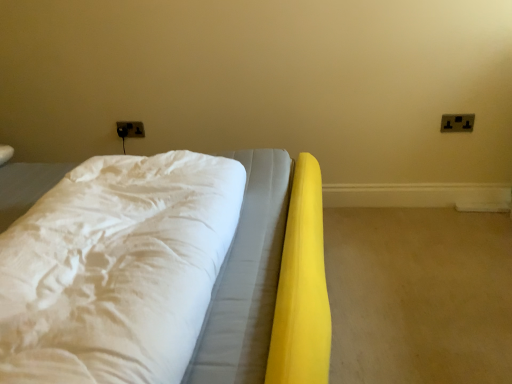
Question: Does black plastic electric outlet at upper right, placed as the first electric outlet when sorted from front to back, appear on the left side of black plastic electrical outlet at upper left, arranged as the second electric outlet when viewed from the right?

Choices:
 (A) yes
 (B) no

Answer: (B)

Question: Can you confirm if black plastic electric outlet at upper right, marked as the 1th electric outlet in a right-to-left arrangement, is wider than black plastic electrical outlet at upper left, which is the first electric outlet in back-to-front order?

Choices:
 (A) no
 (B) yes

Answer: (A)

Question: From the image's perspective, would you say black plastic electric outlet at upper right, arranged as the 2th electric outlet when viewed from the back, is shown under black plastic electrical outlet at upper left, which is counted as the first electric outlet, starting from the left?

Choices:
 (A) yes
 (B) no

Answer: (A)

Question: Can you confirm if black plastic electric outlet at upper right, marked as the 1th electric outlet in a right-to-left arrangement, is shorter than black plastic electrical outlet at upper left, arranged as the second electric outlet when viewed from the right?

Choices:
 (A) yes
 (B) no

Answer: (B)

Question: Does black plastic electric outlet at upper right, arranged as the 2th electric outlet when viewed from the back, have a larger size compared to black plastic electrical outlet at upper left, which is the first electric outlet in back-to-front order?

Choices:
 (A) yes
 (B) no

Answer: (B)

Question: Relative to black plastic electrical outlet at upper left, arranged as the second electric outlet when viewed from the right, is black plastic electric outlet at upper right, arranged as the 2th electric outlet when viewed from the back, in front or behind?

Choices:
 (A) front
 (B) behind

Answer: (A)

Question: Is point (441, 127) closer or farther from the camera than point (130, 132)?

Choices:
 (A) closer
 (B) farther

Answer: (A)

Question: Considering the positions of black plastic electric outlet at upper right, arranged as the 2th electric outlet when viewed from the back, and black plastic electrical outlet at upper left, which is counted as the first electric outlet, starting from the left, in the image, is black plastic electric outlet at upper right, arranged as the 2th electric outlet when viewed from the back, taller or shorter than black plastic electrical outlet at upper left, which is counted as the first electric outlet, starting from the left,?

Choices:
 (A) tall
 (B) short

Answer: (A)

Question: Is black plastic electric outlet at upper right, marked as the 1th electric outlet in a right-to-left arrangement, wider or thinner than black plastic electrical outlet at upper left, which is counted as the first electric outlet, starting from the left?

Choices:
 (A) thin
 (B) wide

Answer: (A)

Question: Is point (60, 168) closer or farther from the camera than point (125, 132)?

Choices:
 (A) farther
 (B) closer

Answer: (B)

Question: Would you say white fabric bed at center is to the left or to the right of black plastic electrical outlet at upper left, which is counted as the first electric outlet, starting from the left, in the picture?

Choices:
 (A) left
 (B) right

Answer: (B)

Question: Considering their positions, is white fabric bed at center located in front of or behind black plastic electrical outlet at upper left, which is counted as the first electric outlet, starting from the left?

Choices:
 (A) front
 (B) behind

Answer: (A)

Question: In terms of width, does white fabric bed at center look wider or thinner when compared to black plastic electrical outlet at upper left, which is counted as the first electric outlet, starting from the left?

Choices:
 (A) thin
 (B) wide

Answer: (B)

Question: Considering the positions of white fabric bed at center and black plastic electric outlet at upper right, placed as the first electric outlet when sorted from front to back, in the image, is white fabric bed at center taller or shorter than black plastic electric outlet at upper right, placed as the first electric outlet when sorted from front to back,?

Choices:
 (A) tall
 (B) short

Answer: (A)

Question: Which is correct: white fabric bed at center is inside black plastic electric outlet at upper right, placed as the 2th electric outlet when sorted from left to right, or outside of it?

Choices:
 (A) inside
 (B) outside

Answer: (B)